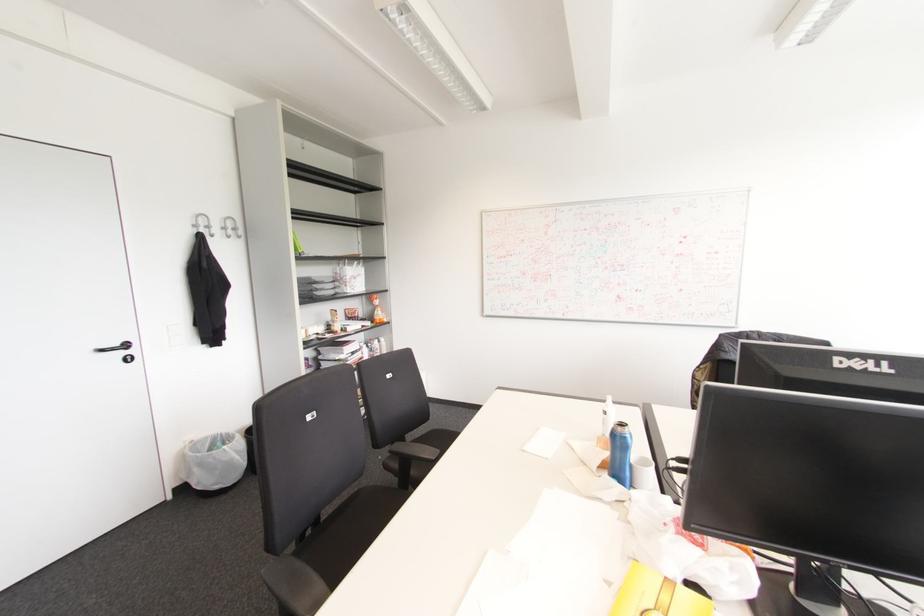
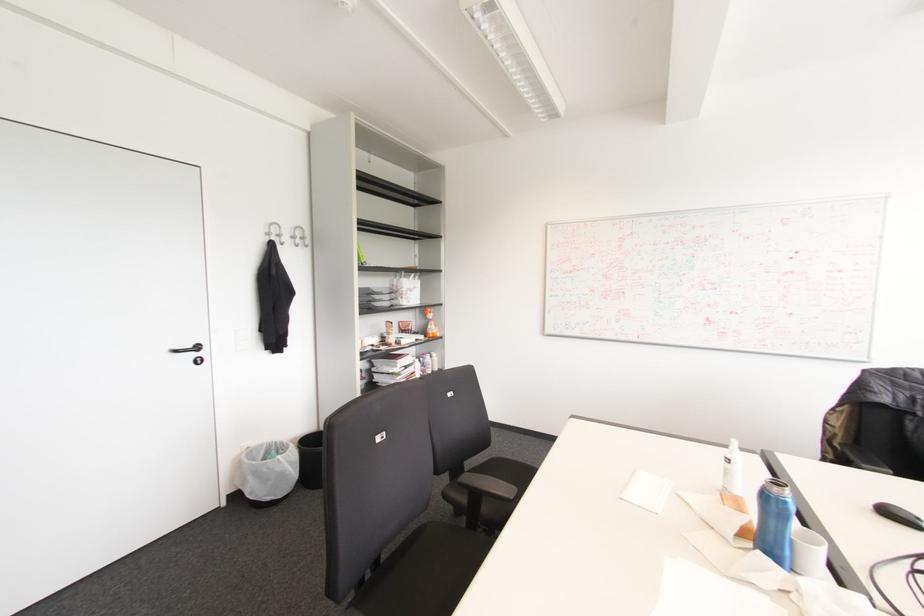
Locate, in the second image, the point that corresponds to (x=234, y=229) in the first image.

(301, 238)